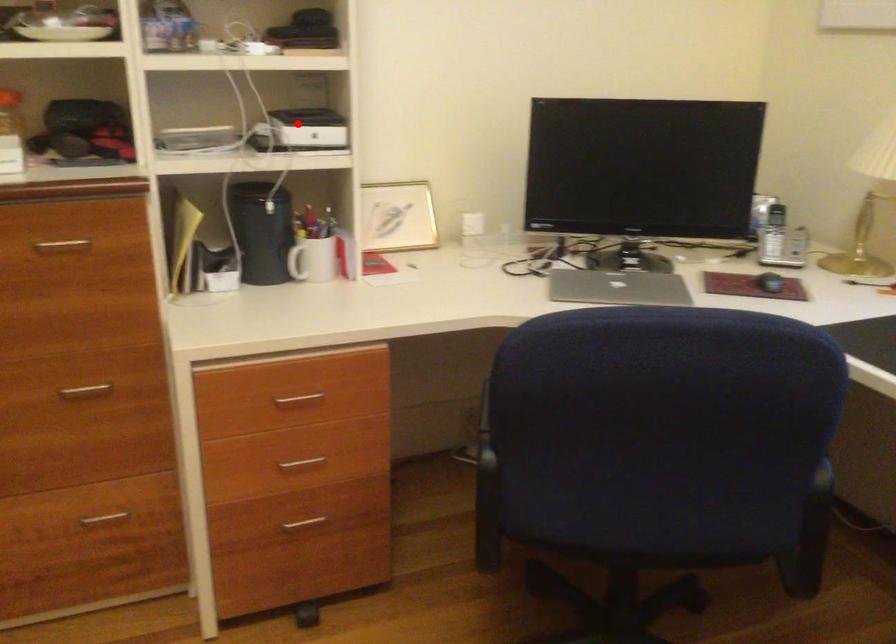
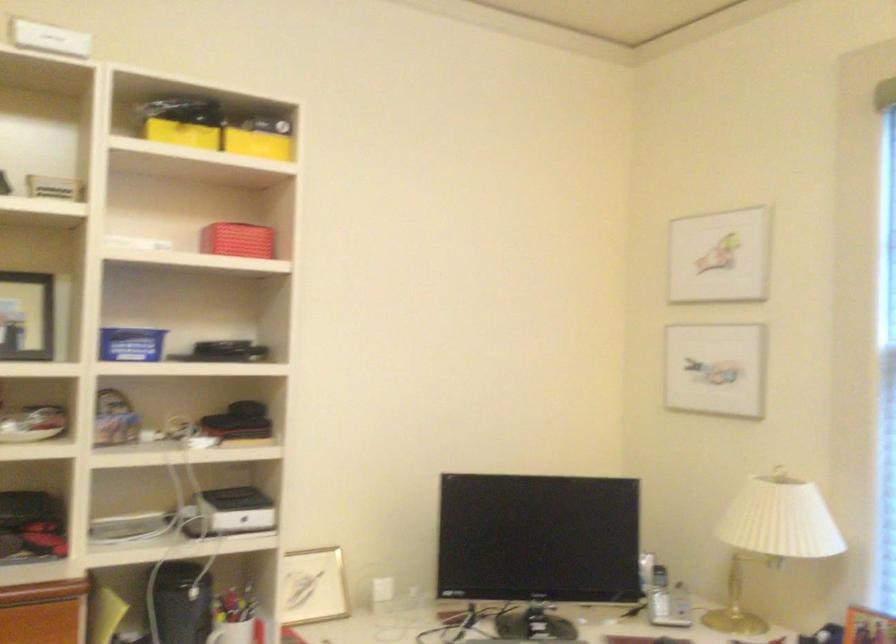
The point at the highlighted location is marked in the first image. Where is the corresponding point in the second image?

(231, 512)